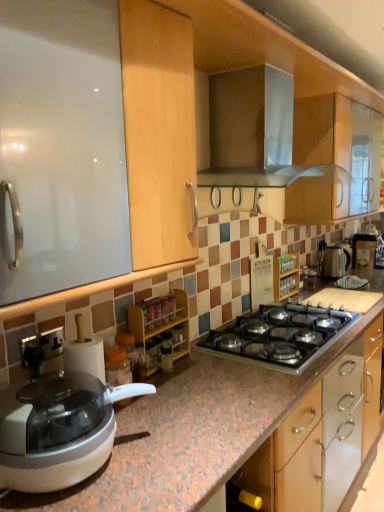
Question: Based on their sizes in the image, would you say satin silver kettle at right, which is counted as the second kitchen appliance, starting from the front, is bigger or smaller than white plastic food processor at lower left?

Choices:
 (A) big
 (B) small

Answer: (B)

Question: In the image, is satin silver kettle at right, which appears as the 2th kitchen appliance when viewed from the top, on the left side or the right side of white plastic food processor at lower left?

Choices:
 (A) right
 (B) left

Answer: (A)

Question: Estimate the real-world distances between objects in this image. Which object is closer to the metallic silver range hood at upper center, placed as the first kitchen appliance when sorted from left to right?

Choices:
 (A) metallic silver gas stove at center
 (B) wooden spice rack at center, acting as the 1th cabinetry starting from the back
 (C) translucent plastic container at center
 (D) satin silver kettle at right, arranged as the 1th kitchen appliance when ordered from the bottom
 (E) wooden spice rack at center, the 2th cabinetry when ordered from back to front

Answer: (E)

Question: Estimate the real-world distances between objects in this image. Which object is closer to the wooden spice rack at center, which is the 1th cabinetry from front to back?

Choices:
 (A) translucent plastic container at center
 (B) metallic silver coffee machine at right
 (C) metallic silver gas stove at center
 (D) white plastic food processor at lower left
 (E) wooden spice rack at center, acting as the 1th cabinetry starting from the back

Answer: (A)